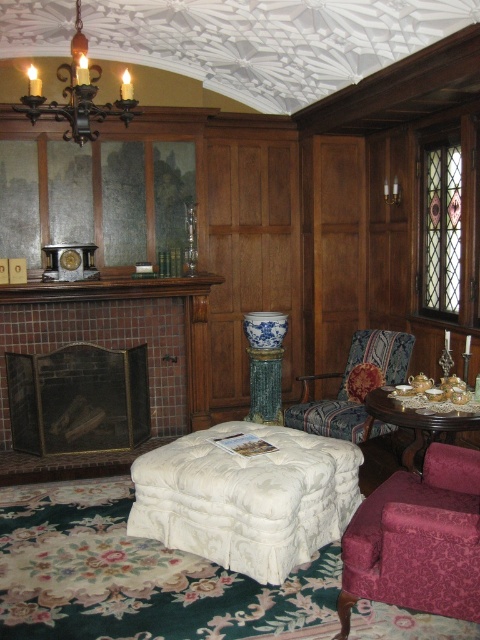
Question: Can you confirm if white tufted ottoman at center is positioned below velvet maroon armchair at lower right?

Choices:
 (A) no
 (B) yes

Answer: (B)

Question: Does polished brass chandelier at upper left appear over wooden polished table at center?

Choices:
 (A) yes
 (B) no

Answer: (A)

Question: Based on their relative distances, which object is farther from the velvet floral-patterned armchair at center?

Choices:
 (A) brass fire screen at left
 (B) white tufted ottoman at center
 (C) polished brass chandelier at upper left

Answer: (C)

Question: Which point appears closest to the camera in this image?

Choices:
 (A) (123, 113)
 (B) (433, 611)
 (C) (373, 403)

Answer: (B)

Question: Can you confirm if brass fire screen at left is positioned to the right of velvet maroon armchair at lower right?

Choices:
 (A) no
 (B) yes

Answer: (A)

Question: Which point is closer to the camera?

Choices:
 (A) polished brass chandelier at upper left
 (B) velvet maroon armchair at lower right
 (C) velvet floral-patterned armchair at center

Answer: (B)